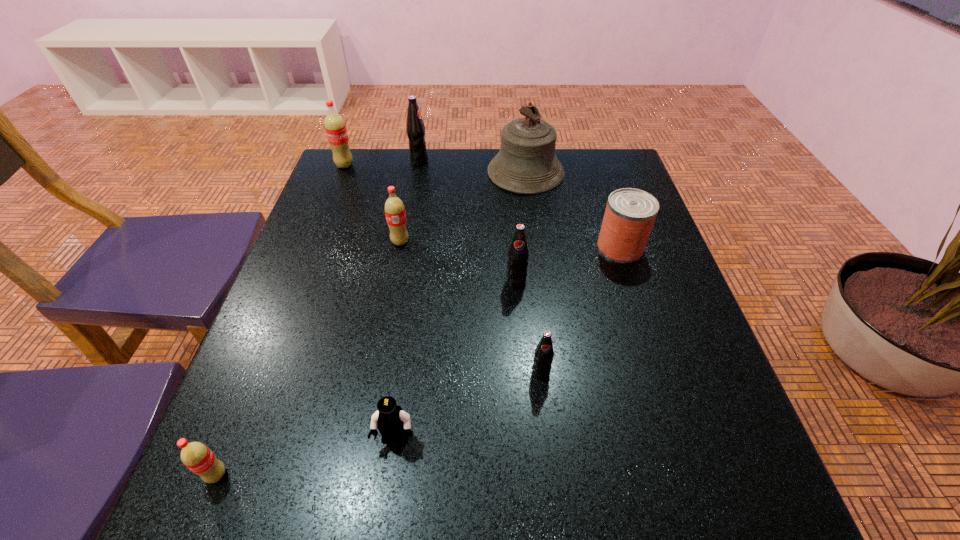
Where is `vacant space in between the bell and the third farthest soda`? vacant space in between the bell and the third farthest soda is located at coordinates (463, 207).

Identify the location of vacant region between the biggest black pop and the black Lego. The width and height of the screenshot is (960, 540). (407, 300).

The image size is (960, 540). In order to click on vacant area that lies between the smallest red soda and the rightmost red soda in this screenshot , I will do `click(308, 358)`.

In order to click on vacant region between the fourth nearest soda and the smallest black pop in this screenshot , I will do point(470,307).

Locate an element on the screen. empty location between the farthest black pop and the bell is located at coordinates (472, 166).

Locate which object is the third closest to the sixth farthest object. Please provide its 2D coordinates. Your answer should be formatted as a tuple, i.e. [(x, y)], where the tuple contains the x and y coordinates of a point satisfying the conditions above.

[(394, 208)]

The image size is (960, 540). Identify the location of object identified as the sixth closest to the biggest red soda. (390, 419).

Select which soda appears as the fourth closest to the second smallest red soda. Please provide its 2D coordinates. Your answer should be formatted as a tuple, i.e. [(x, y)], where the tuple contains the x and y coordinates of a point satisfying the conditions above.

[(543, 356)]

In order to click on soda that is the sixth closest to the can in this screenshot , I will do click(x=196, y=456).

Find the location of a particular element. The width and height of the screenshot is (960, 540). black pop that is the third closest to the farthest red soda is located at coordinates (543, 356).